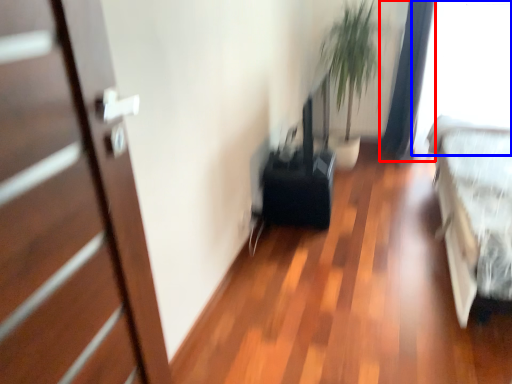
Question: Which of the following is the closest to the observer, curtain (highlighted by a red box) or window screen (highlighted by a blue box)?

Choices:
 (A) curtain
 (B) window screen

Answer: (B)